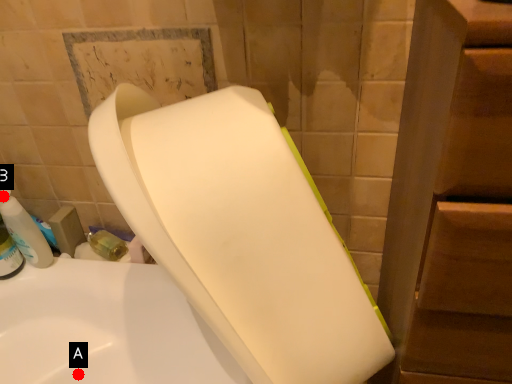
Question: Two points are circled on the image, labeled by A and B beside each circle. Which point is further to the camera?

Choices:
 (A) A is further
 (B) B is further

Answer: (A)